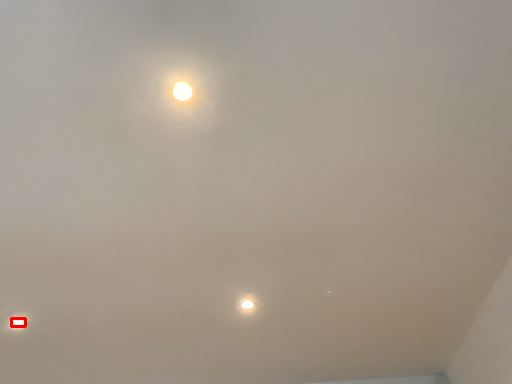
Question: Considering the relative positions of lamp (annotated by the red box) and lamp in the image provided, where is lamp (annotated by the red box) located with respect to the staircase?

Choices:
 (A) right
 (B) left

Answer: (B)